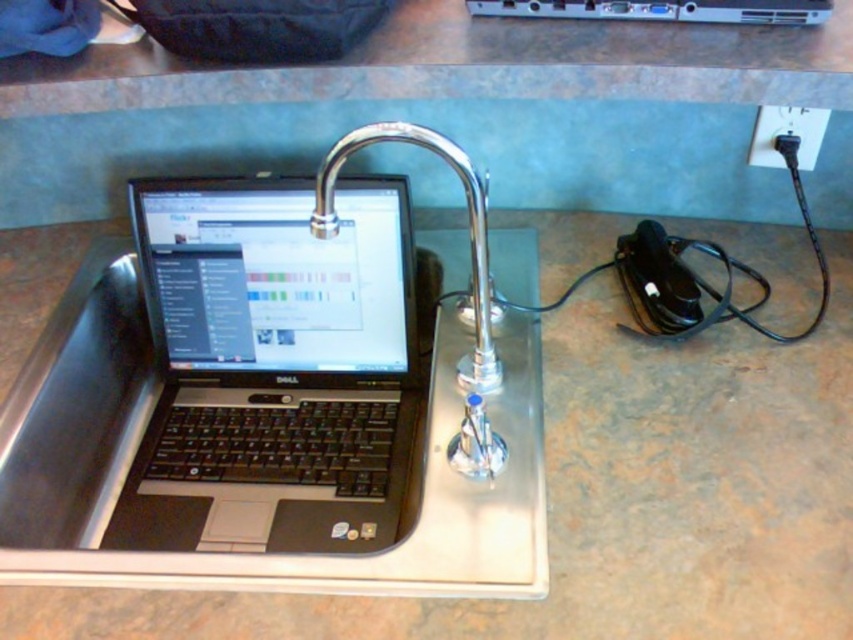
Can you confirm if stainless steel sink at left is taller than black matte laptop at left?

No.

The height and width of the screenshot is (640, 853). What do you see at coordinates (277, 403) in the screenshot?
I see `stainless steel sink at left` at bounding box center [277, 403].

Does point (103, 272) come behind point (202, 356)?

Yes.

The image size is (853, 640). Find the location of `stainless steel sink at left`. stainless steel sink at left is located at coordinates (277, 403).

Does stainless steel sink at left have a lesser height compared to black plastic plug at upper right?

No.

Between stainless steel sink at left and black plastic plug at upper right, which one appears on the left side from the viewer's perspective?

Positioned to the left is stainless steel sink at left.

Identify the location of stainless steel sink at left. (277, 403).

Which is in front, point (103, 412) or point (680, 16)?

Point (680, 16)

Is stainless steel sink at left above metallic silver computer at upper center?

Incorrect, stainless steel sink at left is not positioned above metallic silver computer at upper center.

Describe the element at coordinates (277, 403) in the screenshot. I see `stainless steel sink at left` at that location.

You are a GUI agent. You are given a task and a screenshot of the screen. Output one action in this format:
    pyautogui.click(x=<x>, y=<y>)
    Task: Click on the stainless steel sink at left
    Image resolution: width=853 pixels, height=640 pixels.
    Given the screenshot: What is the action you would take?
    pyautogui.click(x=277, y=403)